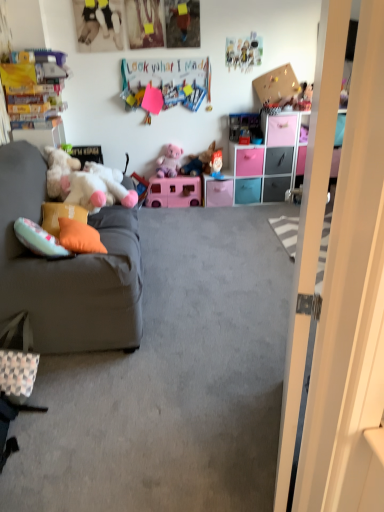
The width and height of the screenshot is (384, 512). I want to click on free area in between white glossy door at right and pink plastic camper at center, positioned as the 5th toy in top-to-bottom order, so click(x=218, y=314).